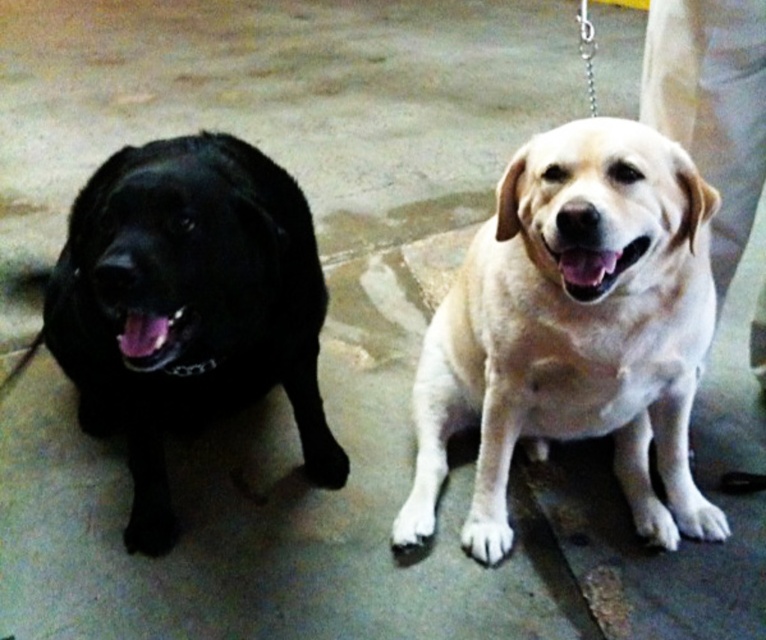
Who is shorter, light beige fur dog at center or matte black dog at left?

With less height is light beige fur dog at center.

Locate an element on the screen. The width and height of the screenshot is (766, 640). light beige fur dog at center is located at coordinates tap(574, 330).